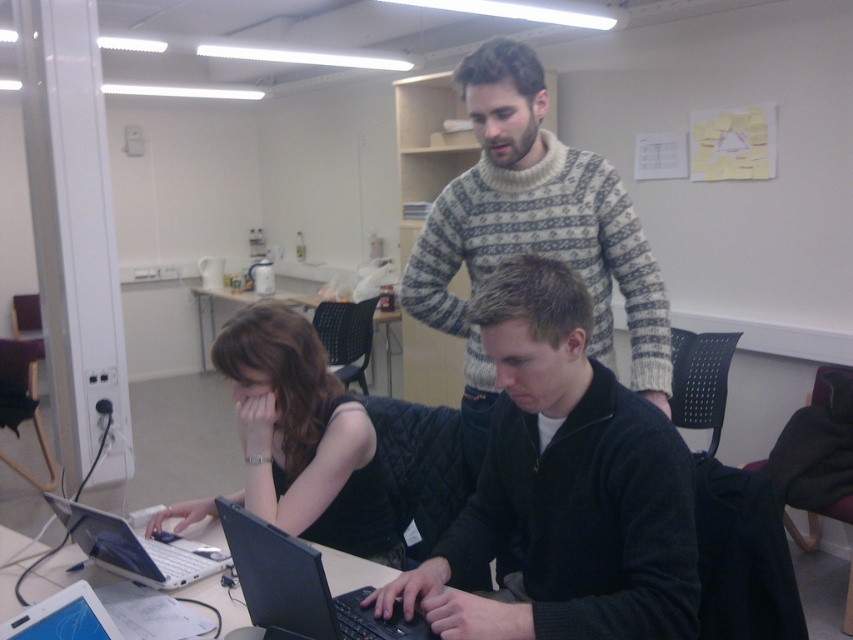
Question: Which of the following is the closest to the observer?

Choices:
 (A) black matte shirt at center
 (B) white glossy laptop at lower left

Answer: (B)

Question: Where is white glossy laptop at lower left located in relation to matte black tablet at lower left in the image?

Choices:
 (A) below
 (B) above

Answer: (A)

Question: Is white glossy laptop at lower left to the left of matte black tablet at lower left from the viewer's perspective?

Choices:
 (A) yes
 (B) no

Answer: (A)

Question: Does white knitted sweater at center have a greater width compared to black plastic table at center?

Choices:
 (A) yes
 (B) no

Answer: (B)

Question: Which point is closer to the camera?

Choices:
 (A) (88, 509)
 (B) (515, 118)
 (C) (351, 580)

Answer: (A)

Question: Which of the following is the closest to the observer?

Choices:
 (A) (682, 608)
 (B) (3, 627)
 (C) (393, 634)
 (D) (137, 572)

Answer: (B)